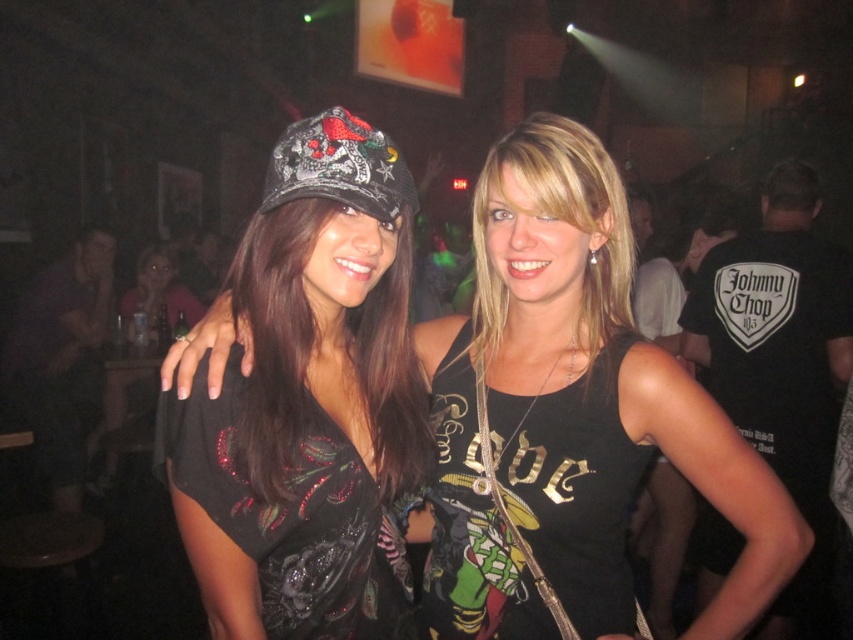
In the scene shown: Who is lower down, black matte tank top at center or black sequined dress at center?

black sequined dress at center

Does black matte tank top at center appear on the right side of black sequined dress at center?

Indeed, black matte tank top at center is positioned on the right side of black sequined dress at center.

Who is more forward, (466, 476) or (369, 621)?

Point (369, 621) is more forward.

At what (x,y) coordinates should I click in order to perform the action: click on black matte tank top at center. Please return your answer as a coordinate pair (x, y). The height and width of the screenshot is (640, 853). Looking at the image, I should click on (573, 486).

How distant is shiny sequined top at center from black sequined dress at center?

The distance of shiny sequined top at center from black sequined dress at center is 10.24 inches.

From the picture: Is shiny sequined top at center smaller than black sequined dress at center?

Actually, shiny sequined top at center might be larger than black sequined dress at center.

Which is behind, point (498, 339) or point (401, 544)?

The point (498, 339) is behind.

Where is `shiny sequined top at center`? shiny sequined top at center is located at coordinates point(572,417).

Looking at this image, can you confirm if shiny sequined top at center is smaller than black matte tank top at center?

Actually, shiny sequined top at center might be larger than black matte tank top at center.

Does shiny sequined top at center have a greater height compared to black matte tank top at center?

Yes.

Who is more distant from viewer, (451,518) or (605,524)?

The point (451,518) is more distant.

Locate an element on the screen. shiny sequined top at center is located at coordinates (572, 417).